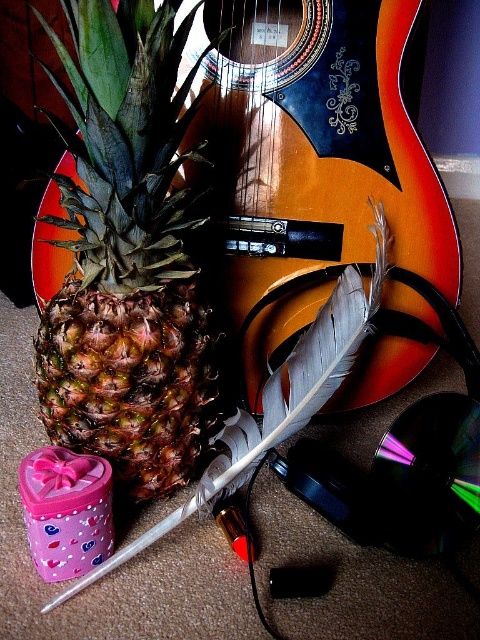
Does glossy wood guitar at upper center appear over brown rough pineapple at center?

Indeed, glossy wood guitar at upper center is positioned over brown rough pineapple at center.

Which of these two, glossy wood guitar at upper center or brown rough pineapple at center, stands shorter?

Standing shorter between the two is brown rough pineapple at center.

Locate an element on the screen. Image resolution: width=480 pixels, height=640 pixels. glossy wood guitar at upper center is located at coordinates (313, 160).